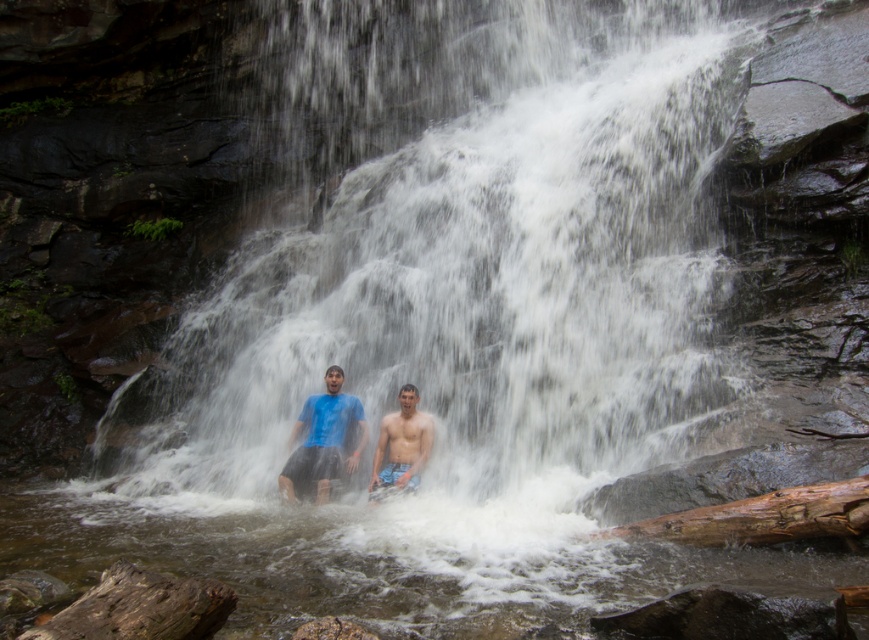
The height and width of the screenshot is (640, 869). What do you see at coordinates (476, 262) in the screenshot?
I see `white frothy water at center` at bounding box center [476, 262].

Between white frothy water at center and blue fabric shorts at lower center, which one has more height?

With more height is white frothy water at center.

Where is `white frothy water at center`? This screenshot has height=640, width=869. white frothy water at center is located at coordinates (476, 262).

Find the location of a particular element. white frothy water at center is located at coordinates (476, 262).

Between point (816, 502) and point (385, 433), which one is positioned behind?

Point (385, 433)

Does brown rough log at lower right appear on the right side of blue fabric shorts at lower center?

Yes, brown rough log at lower right is to the right of blue fabric shorts at lower center.

Who is more distant from viewer, (x=864, y=506) or (x=395, y=477)?

The point (x=395, y=477) is more distant.

Identify the location of brown rough log at lower right. Image resolution: width=869 pixels, height=640 pixels. (763, 516).

Is point (277, 401) positioned behind point (326, 481)?

Yes, point (277, 401) is farther from viewer.

Who is shorter, white frothy water at center or blue matte shirt at center?

With less height is blue matte shirt at center.

Is point (662, 173) closer to camera compared to point (357, 449)?

No, (662, 173) is behind (357, 449).

I want to click on white frothy water at center, so click(476, 262).